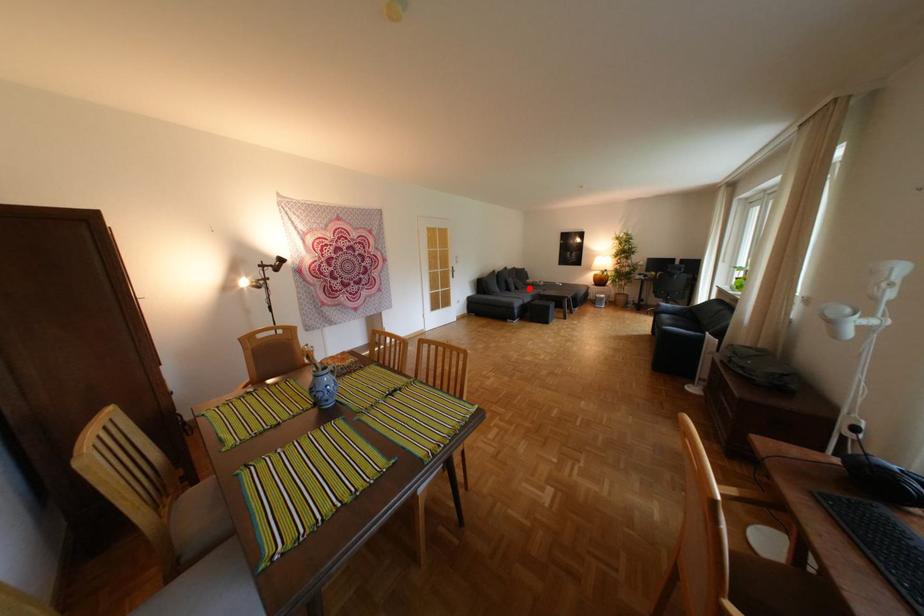
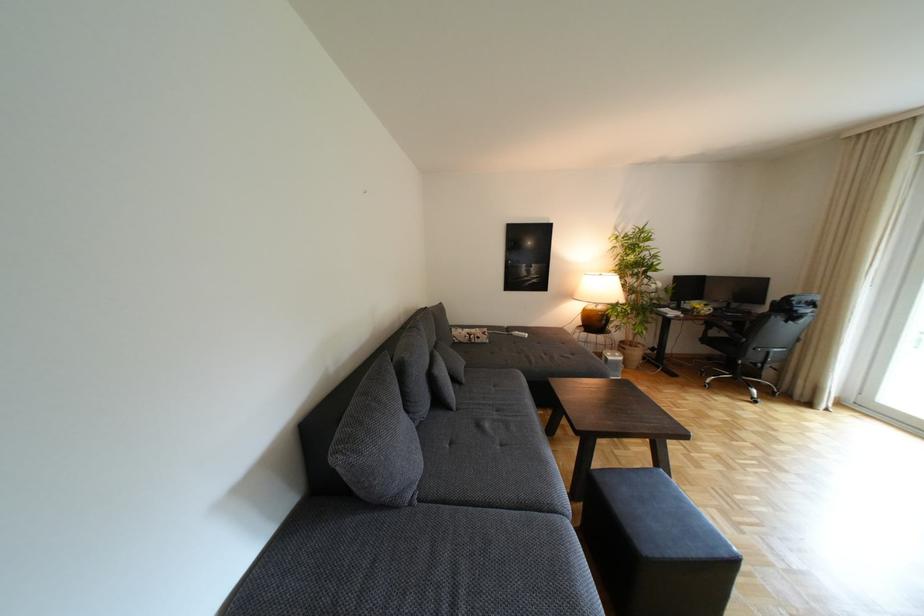
The point at the highlighted location is marked in the first image. Where is the corresponding point in the second image?

(468, 379)